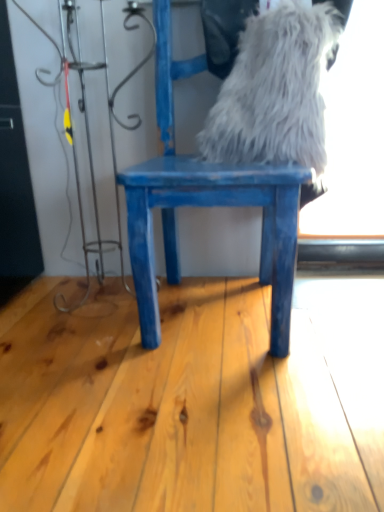
Measure the distance between white fluffy fur at upper center and camera.

They are 99.22 centimeters apart.

I want to click on white fluffy fur at upper center, so tap(276, 90).

Describe the element at coordinates (276, 90) in the screenshot. I see `white fluffy fur at upper center` at that location.

What do you see at coordinates (213, 205) in the screenshot?
I see `blue painted wood chair at center` at bounding box center [213, 205].

Where is `blue painted wood chair at center`? The width and height of the screenshot is (384, 512). blue painted wood chair at center is located at coordinates (213, 205).

The image size is (384, 512). I want to click on white fluffy fur at upper center, so click(276, 90).

Which object is positioned more to the right, white fluffy fur at upper center or blue painted wood chair at center?

From the viewer's perspective, white fluffy fur at upper center appears more on the right side.

Which is behind, white fluffy fur at upper center or blue painted wood chair at center?

white fluffy fur at upper center is further away from the camera.

Which point is more distant from viewer, (216,105) or (281,264)?

Positioned behind is point (216,105).

From the image's perspective, is white fluffy fur at upper center below blue painted wood chair at center?

Incorrect, from the image's perspective, white fluffy fur at upper center is higher than blue painted wood chair at center.

From a real-world perspective, is white fluffy fur at upper center physically located above or below blue painted wood chair at center?

From a real-world perspective, white fluffy fur at upper center is physically above blue painted wood chair at center.

Is white fluffy fur at upper center thinner than blue painted wood chair at center?

Indeed, white fluffy fur at upper center has a lesser width compared to blue painted wood chair at center.

Who is taller, white fluffy fur at upper center or blue painted wood chair at center?

With more height is blue painted wood chair at center.

From the picture: Can you confirm if white fluffy fur at upper center is bigger than blue painted wood chair at center?

No.

Is blue painted wood chair at center inside white fluffy fur at upper center?

No, blue painted wood chair at center is not a part of white fluffy fur at upper center.

Is white fluffy fur at upper center directly adjacent to blue painted wood chair at center?

white fluffy fur at upper center is not next to blue painted wood chair at center, and they're not touching.

Is white fluffy fur at upper center turned away from blue painted wood chair at center?

Yes, white fluffy fur at upper center is positioned with its back facing blue painted wood chair at center.

Can you tell me how much white fluffy fur at upper center and blue painted wood chair at center differ in facing direction?

white fluffy fur at upper center and blue painted wood chair at center are facing 0.000113 degrees away from each other.

Locate an element on the screen. Image resolution: width=384 pixels, height=512 pixels. animal on the right of blue painted wood chair at center is located at coordinates [276, 90].

Is blue painted wood chair at center at the right side of white fluffy fur at upper center?

No.

Relative to white fluffy fur at upper center, is blue painted wood chair at center in front or behind?

Visually, blue painted wood chair at center is located in front of white fluffy fur at upper center.

Does point (128, 196) come in front of point (230, 152)?

Yes.

From the picture: From the image's perspective, between blue painted wood chair at center and white fluffy fur at upper center, which one is located above?

white fluffy fur at upper center.

From a real-world perspective, which is physically below, blue painted wood chair at center or white fluffy fur at upper center?

In real-world perspective, blue painted wood chair at center is lower.

Which of these two, blue painted wood chair at center or white fluffy fur at upper center, is thinner?

white fluffy fur at upper center.

Who is shorter, blue painted wood chair at center or white fluffy fur at upper center?

white fluffy fur at upper center.

Is blue painted wood chair at center smaller than white fluffy fur at upper center?

No.

Does blue painted wood chair at center contain white fluffy fur at upper center?

Yes, blue painted wood chair at center contains white fluffy fur at upper center.

Is there a large distance between blue painted wood chair at center and white fluffy fur at upper center?

blue painted wood chair at center is actually quite close to white fluffy fur at upper center.

Is blue painted wood chair at center oriented towards white fluffy fur at upper center?

No, blue painted wood chair at center does not turn towards white fluffy fur at upper center.

The width and height of the screenshot is (384, 512). Find the location of `chair below the white fluffy fur at upper center (from a real-world perspective)`. chair below the white fluffy fur at upper center (from a real-world perspective) is located at coordinates (213, 205).

In the image, there is a blue painted wood chair at center. Identify the location of animal above it (from the image's perspective). (276, 90).

Identify the location of animal located on the right of blue painted wood chair at center. The width and height of the screenshot is (384, 512). (276, 90).